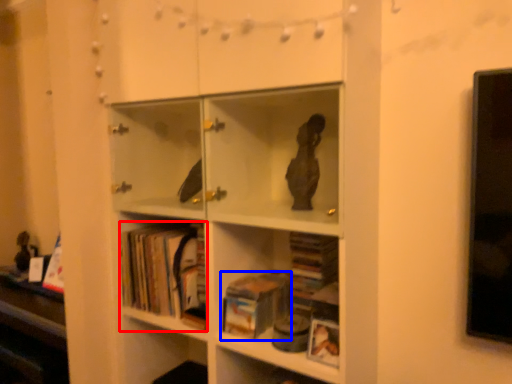
Question: Which point is closer to the camera, book (highlighted by a red box) or book (highlighted by a blue box)?

Choices:
 (A) book
 (B) book

Answer: (B)